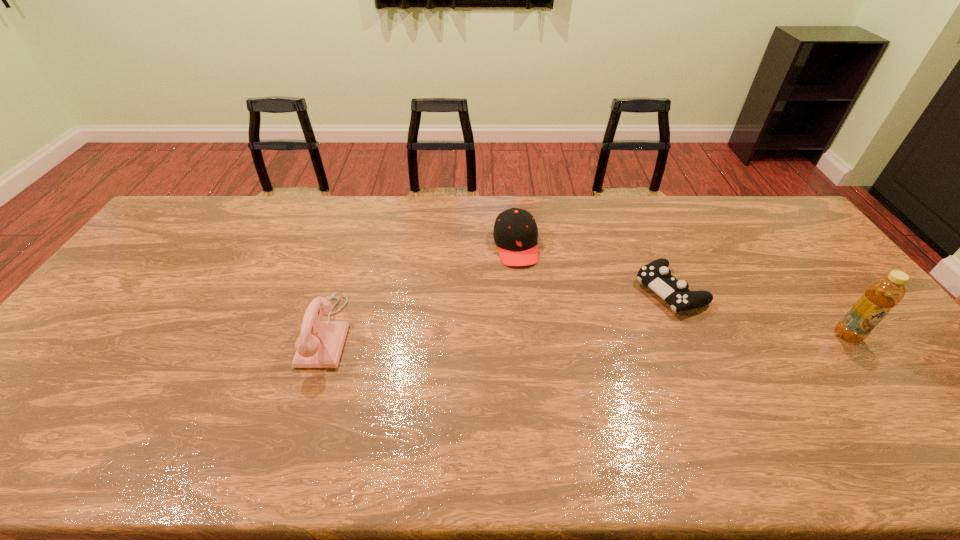
Identify the location of vacant space that is in between the telephone and the shortest object. (498, 311).

Identify the location of unoccupied position between the second object from left to right and the shortest object. The height and width of the screenshot is (540, 960). (592, 268).

Find the location of `unoccupied position between the control and the third object from right to left`. unoccupied position between the control and the third object from right to left is located at coordinates (592, 268).

Point out which object is positioned as the nearest to the second object from right to left. Please provide its 2D coordinates. Your answer should be formatted as a tuple, i.e. [(x, y)], where the tuple contains the x and y coordinates of a point satisfying the conditions above.

[(515, 233)]

Find the location of a particular element. The image size is (960, 540). object that stands as the third closest to the control is located at coordinates (319, 345).

What are the coordinates of `vacant region that satisfies the following two spatial constraints: 1. on the front side of the shortest object; 2. on the right side of the cap` in the screenshot? It's located at (519, 290).